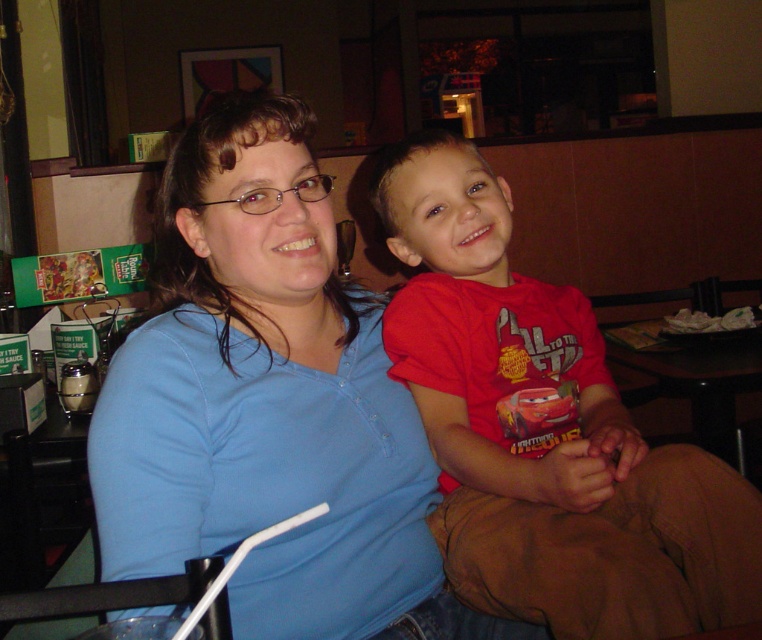
Question: Can you confirm if blue cotton shirt at center is bigger than red cotton shirt at center?

Choices:
 (A) yes
 (B) no

Answer: (A)

Question: In this image, where is blue cotton shirt at center located relative to red cotton shirt at center?

Choices:
 (A) below
 (B) above

Answer: (A)

Question: Which object is farther from the camera taking this photo?

Choices:
 (A) red cotton shirt at center
 (B) blue cotton shirt at center

Answer: (B)

Question: Which point is farther from the camera taking this photo?

Choices:
 (A) (459, 390)
 (B) (327, 196)

Answer: (A)

Question: Can you confirm if blue cotton shirt at center is bigger than red cotton shirt at center?

Choices:
 (A) no
 (B) yes

Answer: (B)